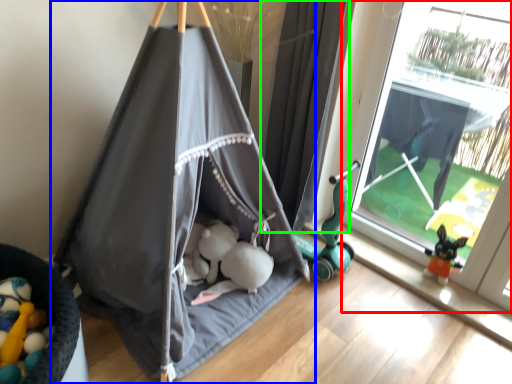
Question: Estimate the real-world distances between objects in this image. Which object is farther from window (highlighted by a red box), tent (highlighted by a blue box) or curtain (highlighted by a green box)?

Choices:
 (A) tent
 (B) curtain

Answer: (A)